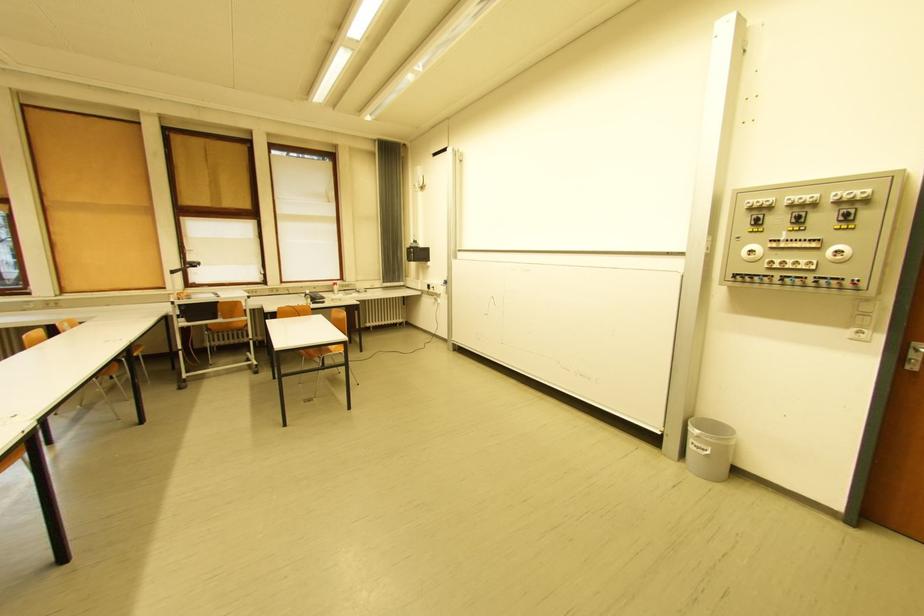
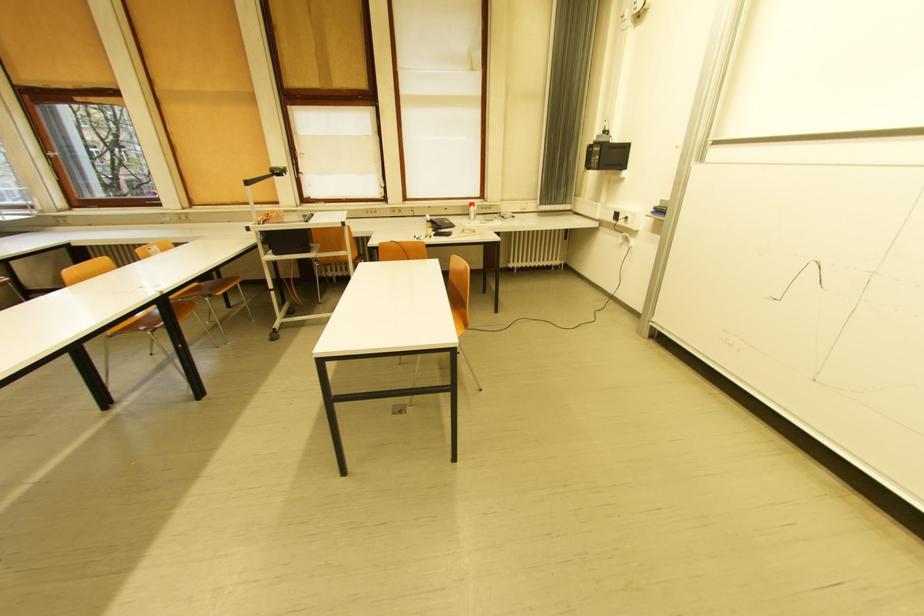
In the second image, find the point that corresponds to (x=415, y=261) in the first image.

(592, 168)